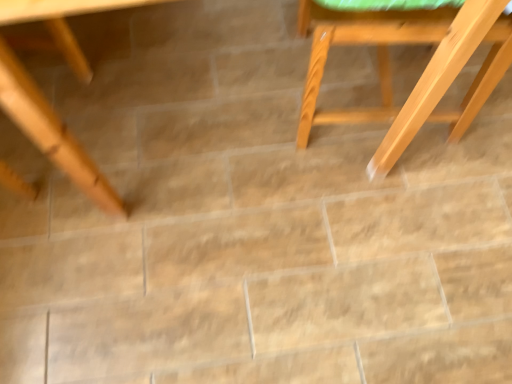
What do you see at coordinates (422, 74) in the screenshot? This screenshot has height=384, width=512. I see `light wood chair at upper right` at bounding box center [422, 74].

What is the approximate height of light wood chair at upper right?

It is 20.14 inches.

Find the location of a particular element. Image resolution: width=512 pixels, height=384 pixels. light wood chair at upper right is located at coordinates (422, 74).

Locate an element on the screen. light wood chair at upper right is located at coordinates (422, 74).